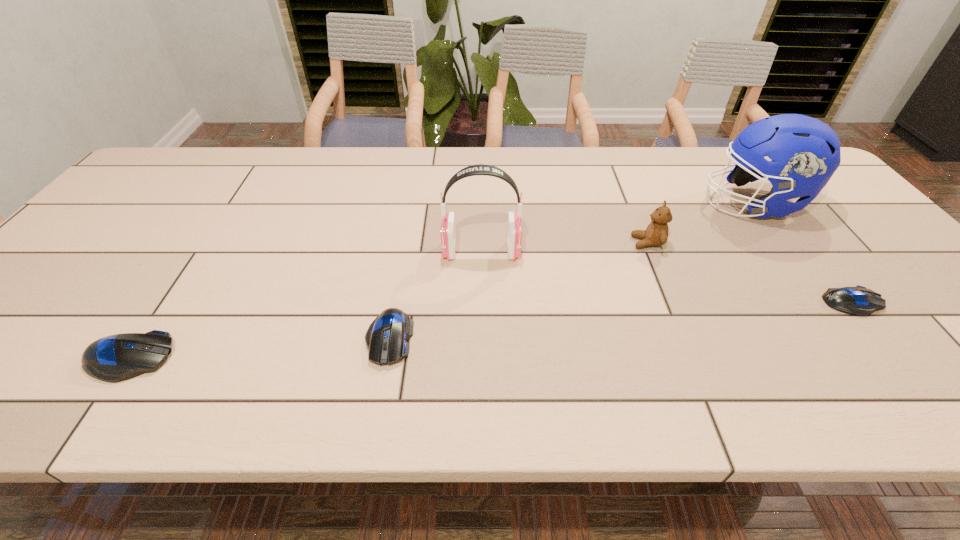
Where is `vacant space situated on the button side of the shortest object`? The height and width of the screenshot is (540, 960). vacant space situated on the button side of the shortest object is located at coordinates (933, 302).

Locate an element on the screen. The width and height of the screenshot is (960, 540). vacant space located on the front-facing side of the farthest object is located at coordinates (672, 204).

Where is `vacant area situated on the front-facing side of the farthest object`? The image size is (960, 540). vacant area situated on the front-facing side of the farthest object is located at coordinates (595, 204).

This screenshot has height=540, width=960. In order to click on vacant space located on the front-facing side of the farthest object in this screenshot , I will do `click(637, 204)`.

This screenshot has height=540, width=960. What are the coordinates of `free space located on the outer surface of the earphone` in the screenshot? It's located at (408, 251).

Locate an element on the screen. free space located 0.200m on the outer surface of the earphone is located at coordinates (365, 251).

Locate an element on the screen. Image resolution: width=960 pixels, height=540 pixels. vacant space located 0.370m on the outer surface of the earphone is located at coordinates (298, 251).

Find the location of `vacant space located 0.370m on the front-facing side of the third object from right to left`. vacant space located 0.370m on the front-facing side of the third object from right to left is located at coordinates (490, 242).

In order to click on free space located on the front-facing side of the third object from right to left in this screenshot , I will do `click(497, 242)`.

Identify the location of vacant space located on the front-facing side of the third object from right to left. This screenshot has height=540, width=960. [x=579, y=242].